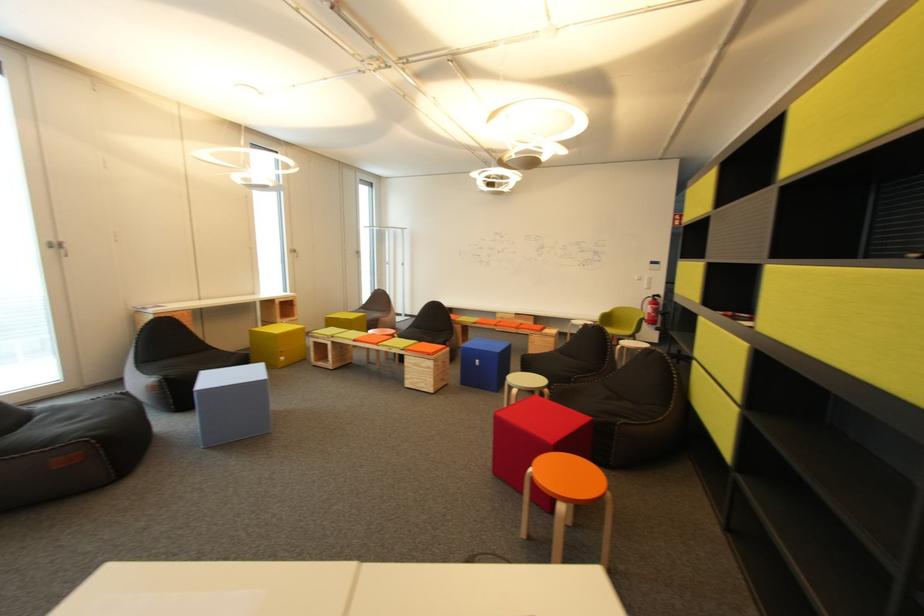
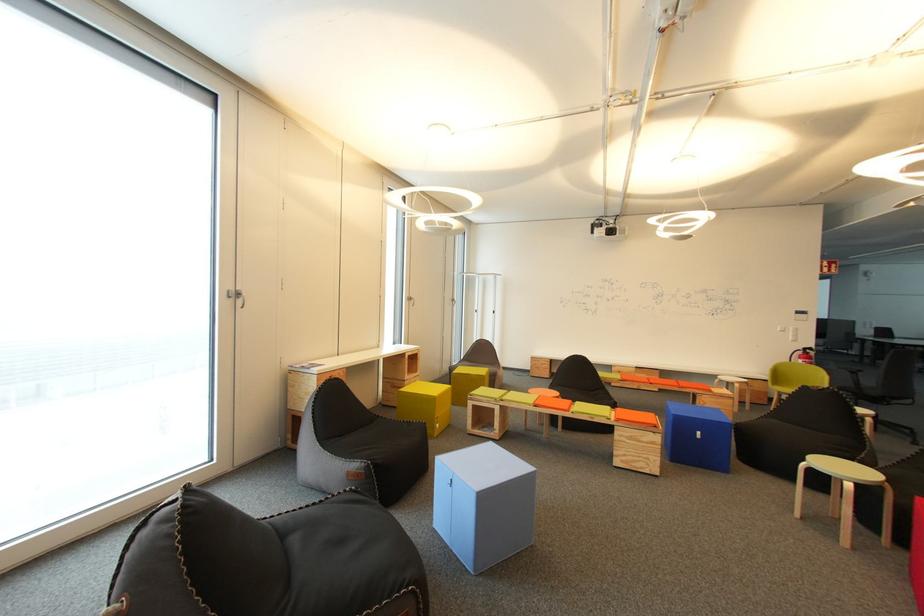
Question: In a continuous first-person perspective shot, in which direction is the camera moving?

Choices:
 (A) Left
 (B) Right
 (C) Forward
 (D) Backward

Answer: (A)